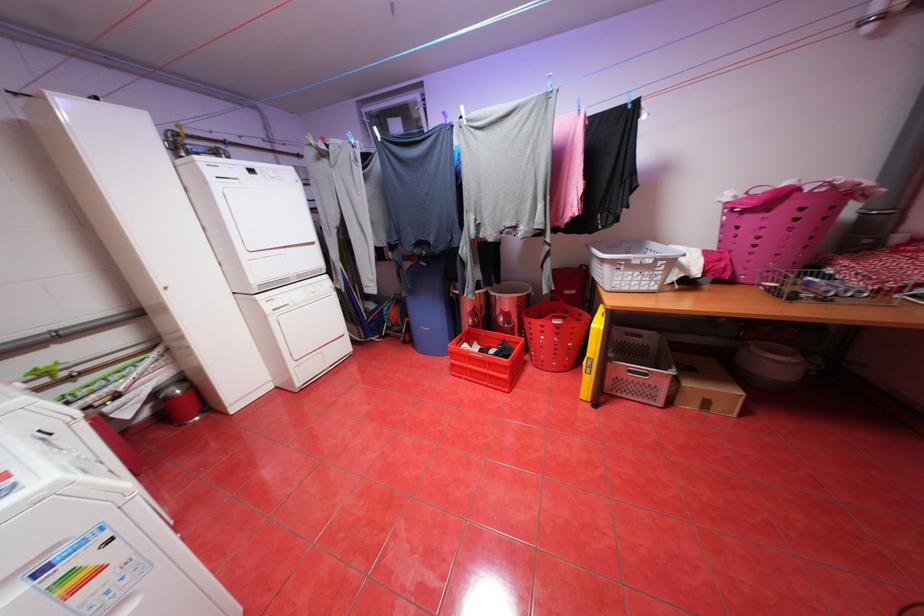
Where would you lift the pink basket handle? Please return your answer as a coordinate pair (x, y).

(821, 185)